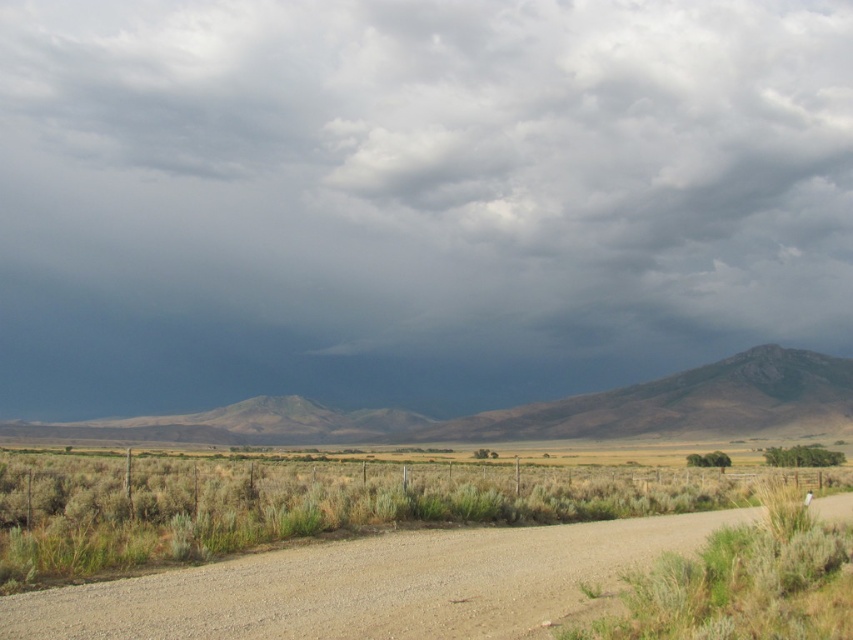
Question: Estimate the real-world distances between objects in this image. Which object is closer to the rugged brown mountain at center?

Choices:
 (A) rugged rock mountain at center
 (B) dark gray cloud at upper center

Answer: (A)

Question: Does green grass at center appear on the left side of rugged rock mountain at center?

Choices:
 (A) no
 (B) yes

Answer: (B)

Question: Among these objects, which one is nearest to the camera?

Choices:
 (A) dark gray cloud at upper center
 (B) rugged rock mountain at center
 (C) rugged brown mountain at center

Answer: (B)

Question: Which of the following is the farthest from the observer?

Choices:
 (A) (370, 236)
 (B) (689, 404)
 (C) (51, 515)
 (D) (252, 429)

Answer: (A)

Question: Is rugged brown mountain at center smaller than rugged rock mountain at center?

Choices:
 (A) yes
 (B) no

Answer: (B)

Question: Can you confirm if dark gray cloud at upper center is bigger than rugged brown mountain at center?

Choices:
 (A) yes
 (B) no

Answer: (A)